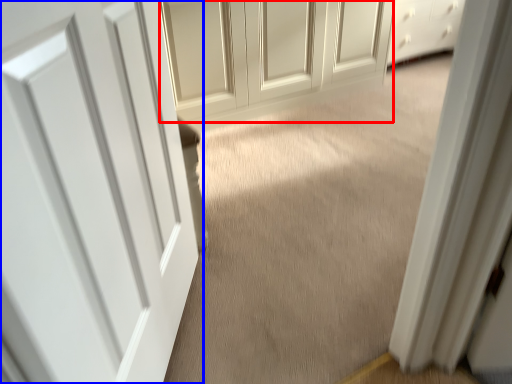
Question: Which point is further to the camera, door (highlighted by a red box) or door (highlighted by a blue box)?

Choices:
 (A) door
 (B) door

Answer: (A)